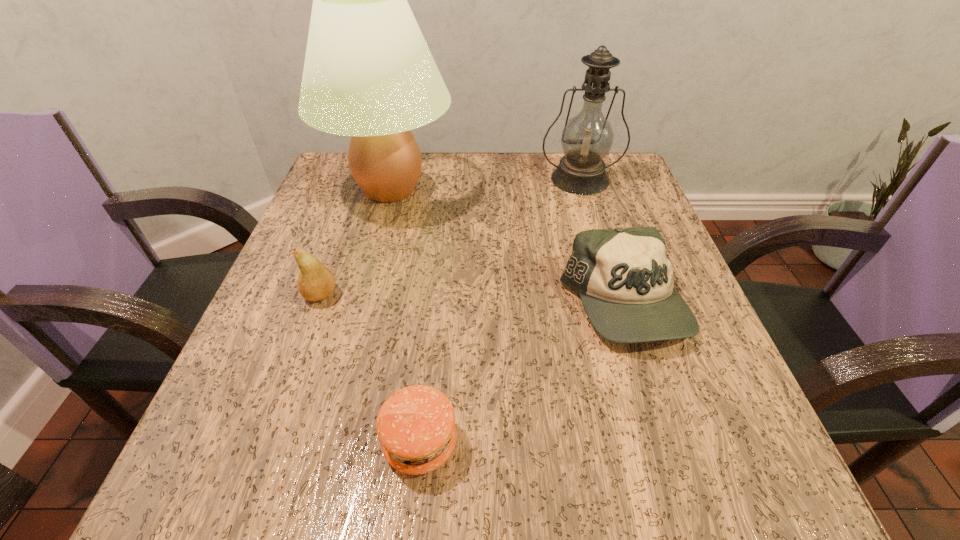
Identify the location of the tallest object. This screenshot has height=540, width=960. (368, 73).

The width and height of the screenshot is (960, 540). Find the location of `oil lamp`. oil lamp is located at coordinates (587, 138).

This screenshot has width=960, height=540. I want to click on pear, so click(x=315, y=282).

Where is `baseball cap`? The image size is (960, 540). baseball cap is located at coordinates (624, 278).

At what (x,y) coordinates should I click in order to perform the action: click on the shortest object. Please return your answer as a coordinate pair (x, y). Looking at the image, I should click on (416, 427).

Find the location of a particular element. This screenshot has width=960, height=540. the nearest object is located at coordinates (416, 427).

Locate an element on the screen. The width and height of the screenshot is (960, 540). free space located 0.200m on the shade of the lampshade is located at coordinates (361, 300).

You are a GUI agent. You are given a task and a screenshot of the screen. Output one action in this format:
    pyautogui.click(x=<x>, y=<y>)
    Task: Click on the blank area located 0.240m on the front of the oil lamp
    
    Given the screenshot: What is the action you would take?
    pyautogui.click(x=607, y=266)

In order to click on vacant space located on the back of the pear in this screenshot , I will do `click(331, 265)`.

Locate an element on the screen. Image resolution: width=960 pixels, height=540 pixels. free space located 0.210m on the front-facing side of the baseball cap is located at coordinates (685, 499).